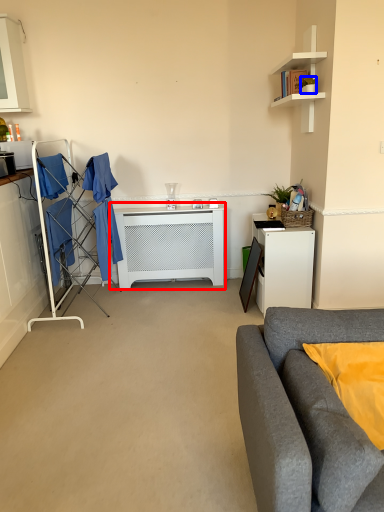
Question: Which object appears farthest to the camera in this image, table (highlighted by a red box) or houseplant (highlighted by a blue box)?

Choices:
 (A) table
 (B) houseplant

Answer: (A)